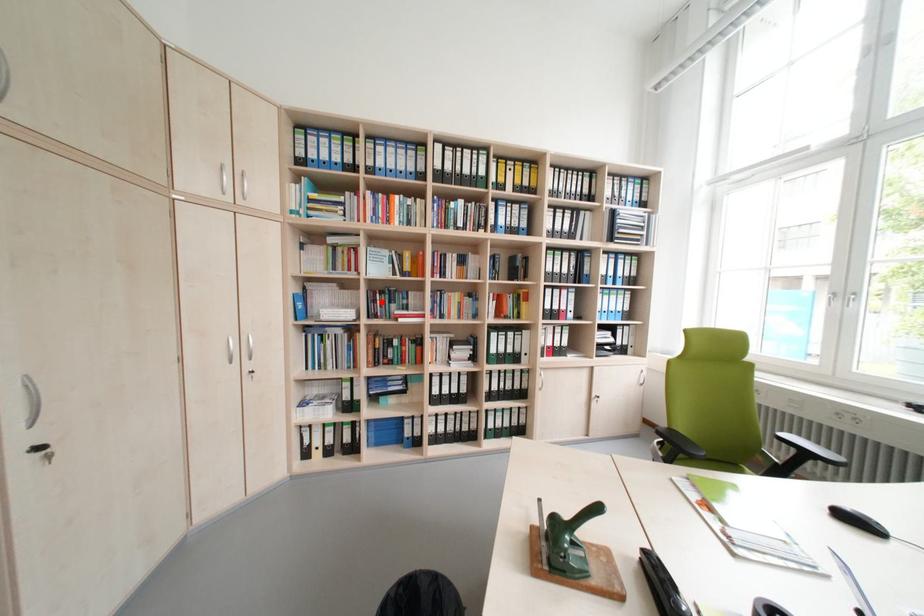
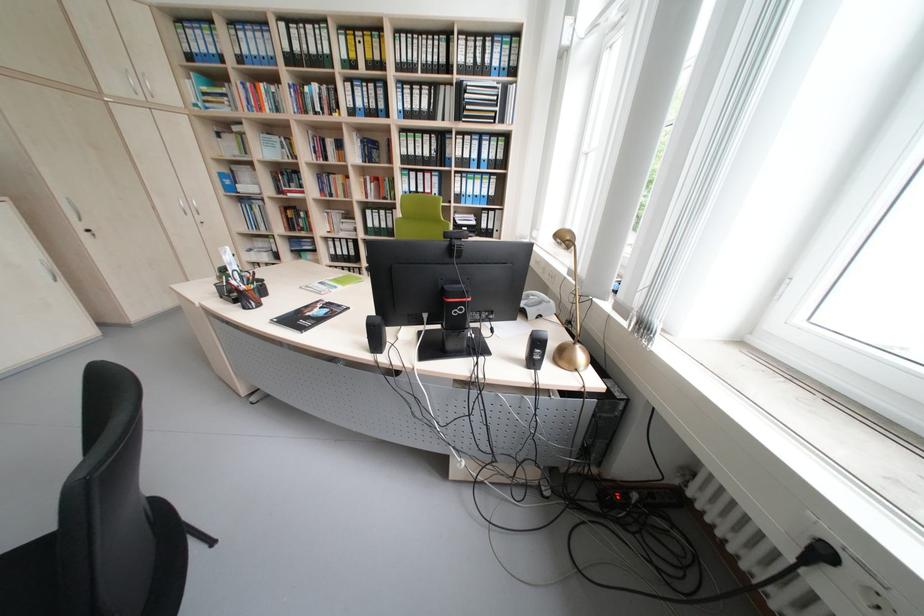
Find the pixel in the second image that matches the highlighted location in the first image.

(286, 182)